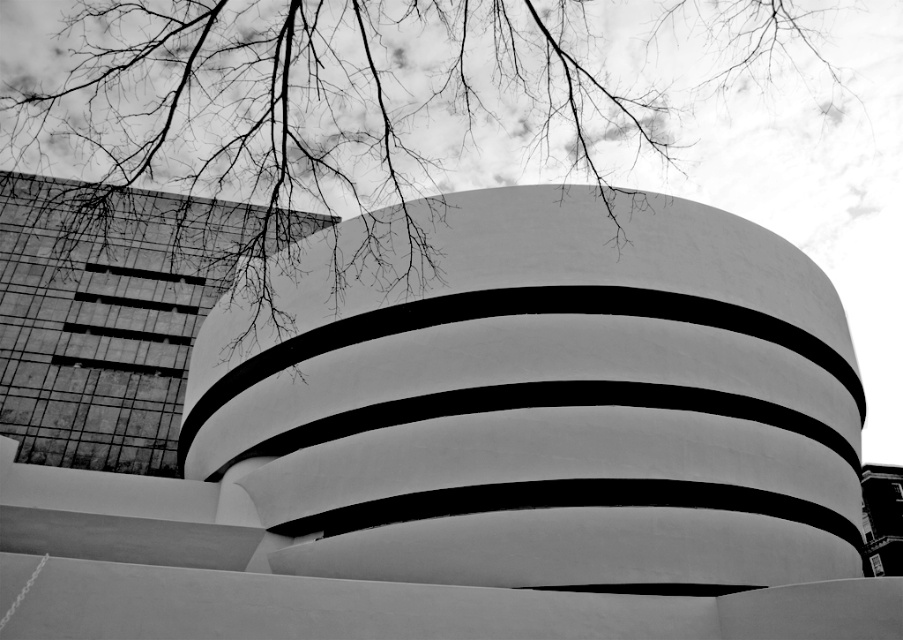
At what (x,y) coordinates should I click in order to perform the action: click on white smooth building at center. Please return your answer as a coordinate pair (x, y). This screenshot has height=640, width=903. Looking at the image, I should click on (475, 442).

Between point (343, 522) and point (606, 168), which one is positioned behind?

The point (606, 168) is more distant.

Locate an element on the screen. This screenshot has width=903, height=640. white smooth building at center is located at coordinates (475, 442).